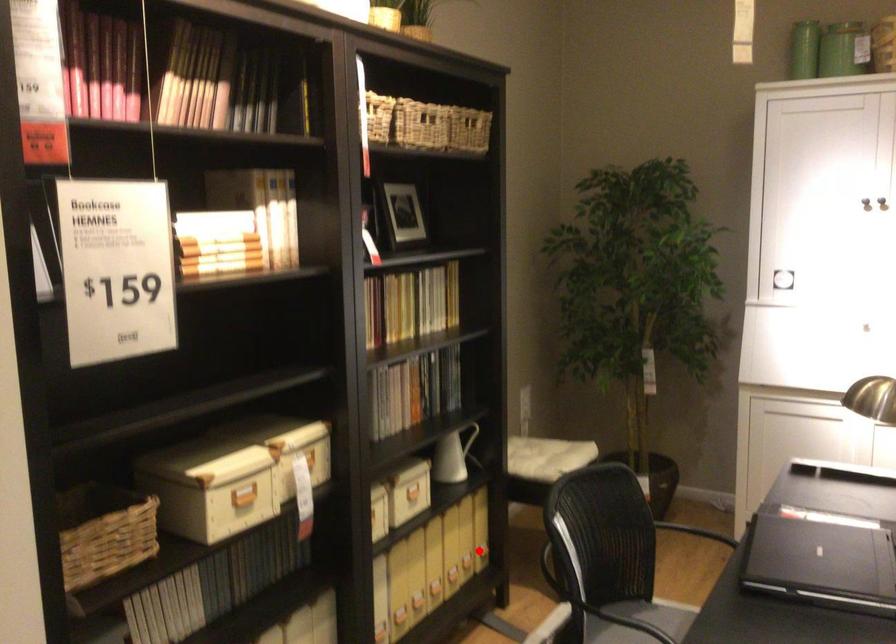
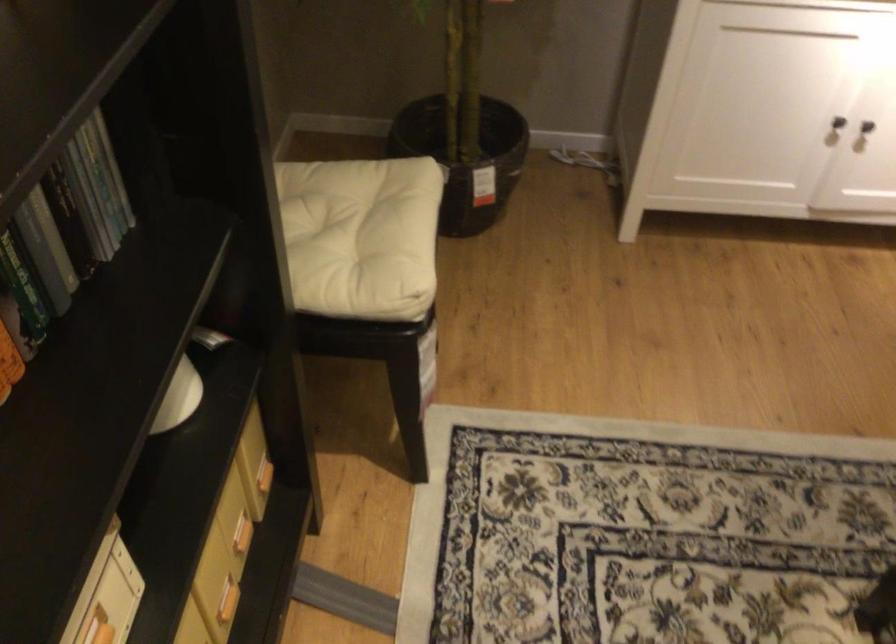
Find the pixel in the second image that matches the highlighted location in the first image.

(263, 476)